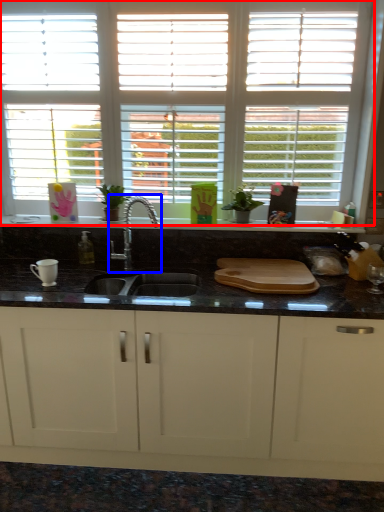
Question: Among these objects, which one is nearest to the camera, window (highlighted by a red box) or tap (highlighted by a blue box)?

Choices:
 (A) window
 (B) tap

Answer: (B)